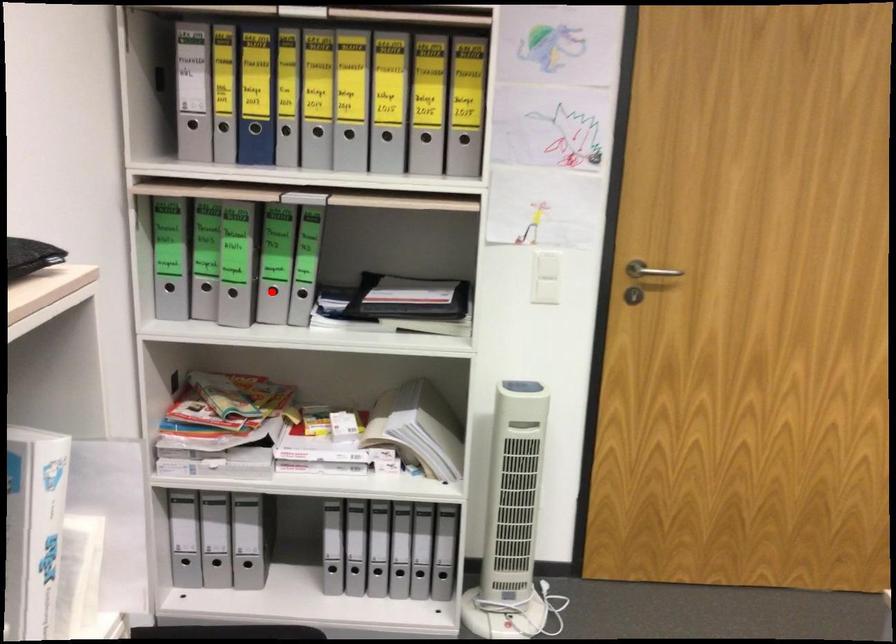
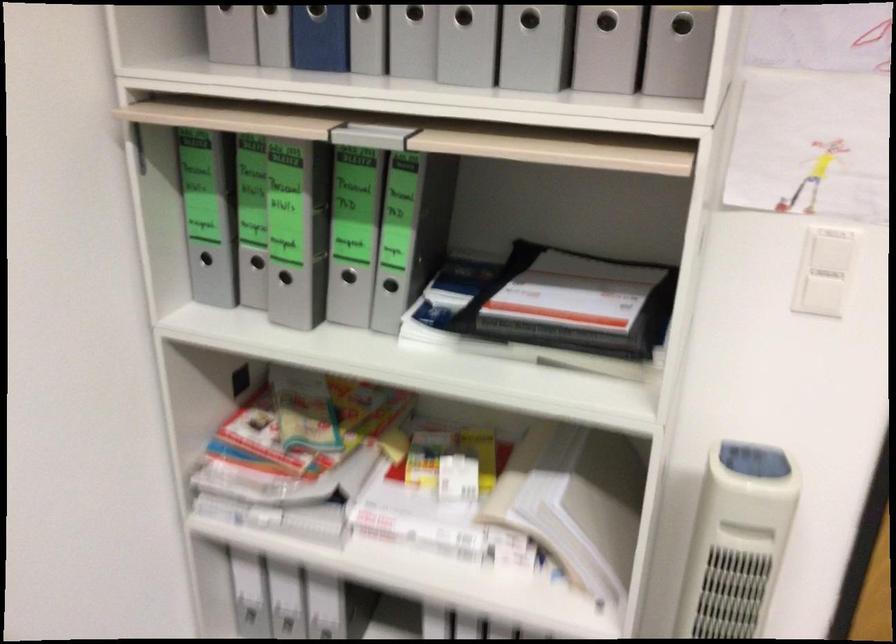
Where in the second image is the point corresponding to the highlighted location from the first image?

(348, 276)